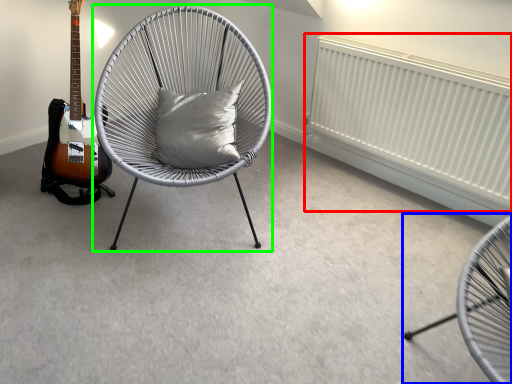
Question: Considering the real-world distances, which object is closest to radiator (highlighted by a red box)? chair (highlighted by a blue box) or chair (highlighted by a green box).

Choices:
 (A) chair
 (B) chair

Answer: (B)